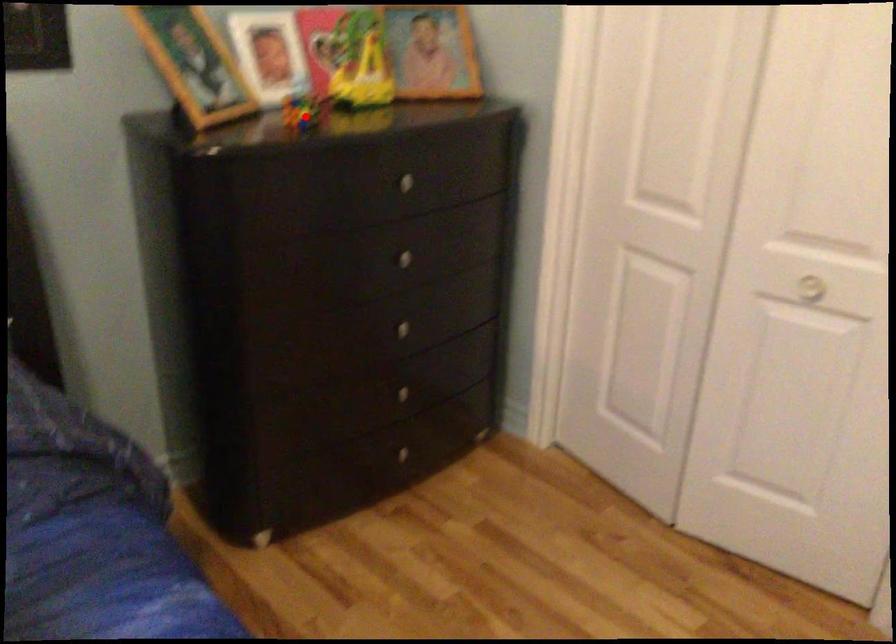
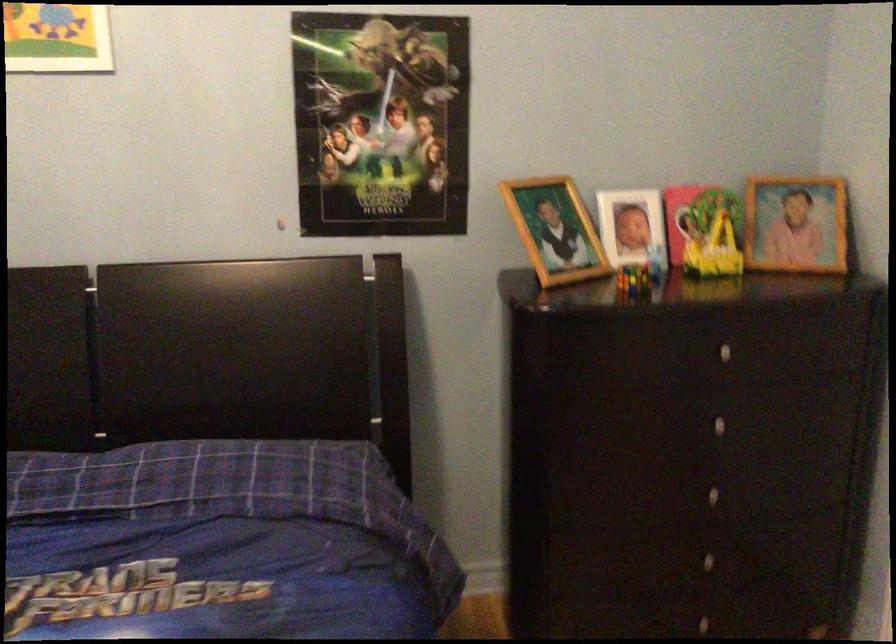
Question: I am providing you with two images of the same scene from different viewpoints. Image1 has a red point marked. In image2, the corresponding 3D location appears at what relative position? Reply with the corresponding letter.

Choices:
 (A) Closer
 (B) Farther

Answer: (B)